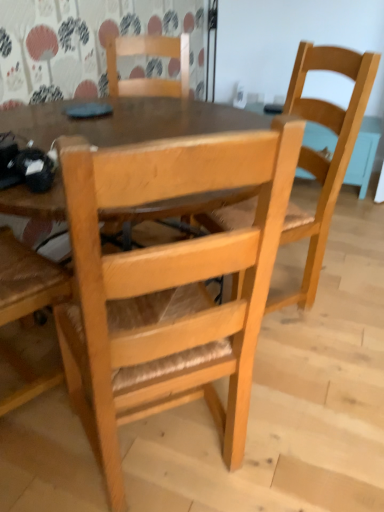
Looking at this image, what is the approximate height of natural wood chair at center, the first chair positioned from the front?

3.44 feet.

The width and height of the screenshot is (384, 512). What do you see at coordinates (321, 156) in the screenshot? I see `natural wood chair at right, the 2th chair when ordered from front to back` at bounding box center [321, 156].

This screenshot has height=512, width=384. I want to click on natural wood chair at center, the first chair positioned from the front, so click(x=168, y=288).

Is natural wood chair at center, the 3th chair from the front, turned away from natural wood chair at center, the first chair positioned from the front?

natural wood chair at center, the 3th chair from the front, is not turned away from natural wood chair at center, the first chair positioned from the front.

Is natural wood chair at center, the 3th chair from the front, next to natural wood chair at center, which appears as the third chair when viewed from the back, and touching it?

No.

Is natural wood chair at center, arranged as the first chair when viewed from the back, at the left side of natural wood chair at center, which appears as the third chair when viewed from the back?

Yes, natural wood chair at center, arranged as the first chair when viewed from the back, is to the left of natural wood chair at center, which appears as the third chair when viewed from the back.

Find the location of a particular element. chair above the natural wood chair at right, the second chair viewed from the back (from the image's perspective) is located at coordinates (148, 55).

Which of these two, natural wood chair at right, the second chair viewed from the back, or natural wood chair at center, arranged as the first chair when viewed from the back, stands taller?

natural wood chair at center, arranged as the first chair when viewed from the back.

From a real-world perspective, is natural wood chair at right, the 2th chair when ordered from front to back, located beneath natural wood chair at center, arranged as the first chair when viewed from the back?

Yes, from a real-world perspective, natural wood chair at right, the 2th chair when ordered from front to back, is under natural wood chair at center, arranged as the first chair when viewed from the back.

Is natural wood chair at right, the 2th chair when ordered from front to back, behind natural wood chair at center, arranged as the first chair when viewed from the back?

No, the depth of natural wood chair at right, the 2th chair when ordered from front to back, is less than that of natural wood chair at center, arranged as the first chair when viewed from the back.

Identify the location of chair that is the 2nd one when counting forward from the natural wood chair at center, the 3th chair from the front. The height and width of the screenshot is (512, 384). (168, 288).

Is natural wood chair at center, the first chair positioned from the front, facing away from natural wood chair at center, the 3th chair from the front?

natural wood chair at center, the first chair positioned from the front, is not turned away from natural wood chair at center, the 3th chair from the front.

Considering the sizes of objects natural wood chair at center, which appears as the third chair when viewed from the back, and natural wood chair at center, arranged as the first chair when viewed from the back, in the image provided, who is wider, natural wood chair at center, which appears as the third chair when viewed from the back, or natural wood chair at center, arranged as the first chair when viewed from the back,?

Wider between the two is natural wood chair at center, which appears as the third chair when viewed from the back.

Is natural wood chair at right, the 2th chair when ordered from front to back, surrounded by natural wood chair at center, the first chair positioned from the front?

No.

Considering the sizes of natural wood chair at center, which appears as the third chair when viewed from the back, and natural wood chair at right, the 2th chair when ordered from front to back, in the image, is natural wood chair at center, which appears as the third chair when viewed from the back, bigger or smaller than natural wood chair at right, the 2th chair when ordered from front to back,?

In the image, natural wood chair at center, which appears as the third chair when viewed from the back, appears to be smaller than natural wood chair at right, the 2th chair when ordered from front to back.

From a real-world perspective, is natural wood chair at center, the first chair positioned from the front, physically below natural wood chair at right, the second chair viewed from the back?

Yes, from a real-world perspective, natural wood chair at center, the first chair positioned from the front, is beneath natural wood chair at right, the second chair viewed from the back.

Is natural wood chair at center, which appears as the third chair when viewed from the back, positioned with its back to natural wood chair at right, the second chair viewed from the back?

natural wood chair at center, which appears as the third chair when viewed from the back, does not have its back to natural wood chair at right, the second chair viewed from the back.

Looking at this image, between natural wood chair at right, the 2th chair when ordered from front to back, and natural wood chair at center, the first chair positioned from the front, which one has more height?

natural wood chair at right, the 2th chair when ordered from front to back.

Which is farther, [226,221] or [81,269]?

The point [226,221] is farther.

Considering the relative positions of natural wood chair at right, the 2th chair when ordered from front to back, and natural wood chair at center, the first chair positioned from the front, in the image provided, is natural wood chair at right, the 2th chair when ordered from front to back, to the left or to the right of natural wood chair at center, the first chair positioned from the front,?

From the image, it's evident that natural wood chair at right, the 2th chair when ordered from front to back, is to the right of natural wood chair at center, the first chair positioned from the front.

Is point (143, 48) farther from camera compared to point (299, 163)?

Yes, it is behind point (299, 163).

Considering the relative sizes of natural wood chair at center, the 3th chair from the front, and natural wood chair at right, the 2th chair when ordered from front to back, in the image provided, is natural wood chair at center, the 3th chair from the front, shorter than natural wood chair at right, the 2th chair when ordered from front to back,?

No.

From the image's perspective, who appears lower, natural wood chair at center, the 3th chair from the front, or natural wood chair at right, the 2th chair when ordered from front to back?

natural wood chair at right, the 2th chair when ordered from front to back, is shown below in the image.

Locate an element on the screen. the 2nd chair behind the natural wood chair at center, the first chair positioned from the front, starting your count from the anchor is located at coordinates (148, 55).

From the natural wood chair at right, the second chair viewed from the back, count the 2nd chair to the left and point to it. Please provide its 2D coordinates.

[(148, 55)]

Which object lies nearer to the anchor point natural wood chair at center, the first chair positioned from the front, natural wood chair at right, the second chair viewed from the back, or natural wood chair at center, arranged as the first chair when viewed from the back?

Based on the image, natural wood chair at right, the second chair viewed from the back, appears to be nearer to natural wood chair at center, the first chair positioned from the front.

From the image, which object appears to be farther from natural wood chair at center, the 3th chair from the front, natural wood chair at center, the first chair positioned from the front, or natural wood chair at right, the second chair viewed from the back?

natural wood chair at center, the first chair positioned from the front, lies further to natural wood chair at center, the 3th chair from the front, than the other object.

Estimate the real-world distances between objects in this image. Which object is further from natural wood chair at center, the 3th chair from the front, natural wood chair at right, the 2th chair when ordered from front to back, or natural wood chair at center, the first chair positioned from the front?

natural wood chair at center, the first chair positioned from the front.

Which object lies further to the anchor point natural wood chair at right, the second chair viewed from the back, natural wood chair at center, arranged as the first chair when viewed from the back, or natural wood chair at center, which appears as the third chair when viewed from the back?

Among the two, natural wood chair at center, arranged as the first chair when viewed from the back, is located further to natural wood chair at right, the second chair viewed from the back.

From the image, which object appears to be farther from natural wood chair at right, the second chair viewed from the back, natural wood chair at center, which appears as the third chair when viewed from the back, or natural wood chair at center, the 3th chair from the front?

Based on the image, natural wood chair at center, the 3th chair from the front, appears to be further to natural wood chair at right, the second chair viewed from the back.

From the picture: From the image, which object appears to be nearer to natural wood chair at center, the first chair positioned from the front, natural wood chair at center, arranged as the first chair when viewed from the back, or natural wood chair at right, the second chair viewed from the back?

Among the two, natural wood chair at right, the second chair viewed from the back, is located nearer to natural wood chair at center, the first chair positioned from the front.

Where is `chair located between natural wood chair at center, the first chair positioned from the front, and natural wood chair at center, arranged as the first chair when viewed from the back, in the depth direction`? Image resolution: width=384 pixels, height=512 pixels. chair located between natural wood chair at center, the first chair positioned from the front, and natural wood chair at center, arranged as the first chair when viewed from the back, in the depth direction is located at coordinates (321, 156).